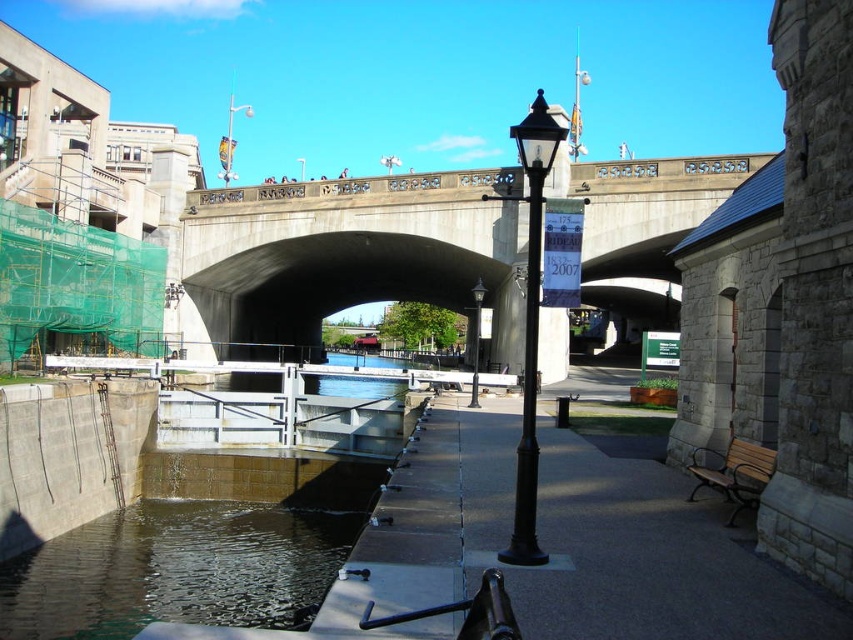
You are a delivery drone with a wingspan of 3 meters. You need to fly through the gap between the concrete bridge at center and the black metal pole at center. Can you fit through the gap without touching either structure?

The gap between the concrete bridge at center and the black metal pole at center is 36.53 meters. Since your wingspan is only 3 meters, you can easily fit through the gap without touching either structure.

You are standing on the walkway near the black lamppost on the right side. You want to cross to the other side of the canal lock system. The concrete bridge at center is the only crossing available. Can you reach the bridge from your current position without getting wet?

The concrete bridge at center is 233.46 feet away from you. Since it is the only crossing available, you can walk towards it along the walkway to reach the bridge safely without getting wet.

You are a city planner assessing the walkway between the black metal pole at center and the black metal lamp post at center. Which object has a greater width?

The black metal pole at center has a greater width than the black metal lamp post at center as stated in the description.